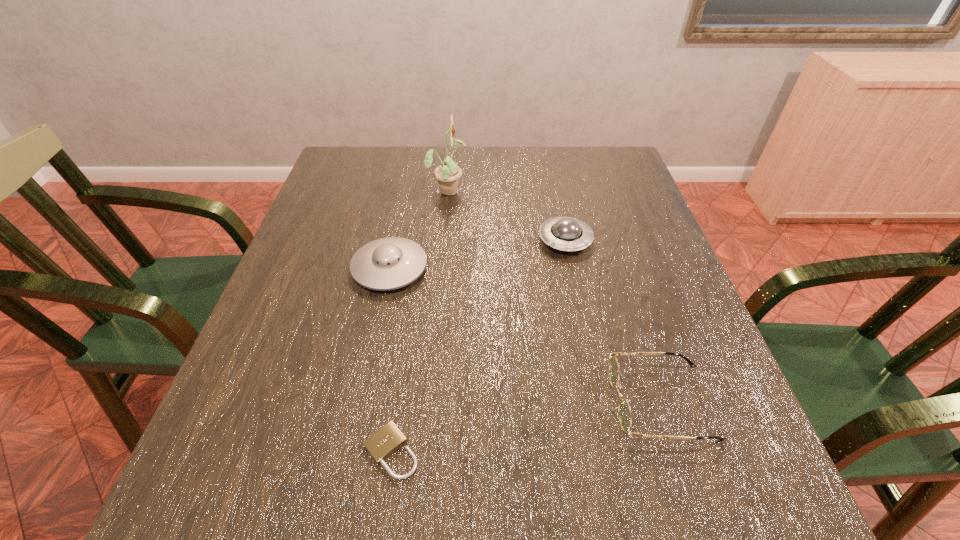
Image resolution: width=960 pixels, height=540 pixels. I want to click on vacant region located 0.310m on the lenses of the spectacles, so click(434, 401).

At what (x,y) coordinates should I click in order to perform the action: click on vacant area situated 0.150m on the lenses of the spectacles. Please return your answer as a coordinate pair (x, y). Looking at the image, I should click on (526, 401).

In order to click on vacant space situated on the back of the padlock in this screenshot , I will do `click(416, 279)`.

This screenshot has width=960, height=540. Find the location of `object that is at the far edge`. object that is at the far edge is located at coordinates (448, 173).

The image size is (960, 540). Find the location of `object located in the near edge section of the desktop`. object located in the near edge section of the desktop is located at coordinates (383, 443).

At what (x,y) coordinates should I click in order to perform the action: click on object that is at the left edge. Please return your answer as a coordinate pair (x, y). Looking at the image, I should click on (389, 263).

At what (x,y) coordinates should I click in order to perform the action: click on object located in the right edge section of the desktop. Please return your answer as a coordinate pair (x, y). Looking at the image, I should click on (624, 412).

In the image, there is a desktop. What are the coordinates of `free space at the far edge` in the screenshot? It's located at (414, 146).

Image resolution: width=960 pixels, height=540 pixels. I want to click on vacant space at the near edge of the desktop, so click(530, 480).

The image size is (960, 540). I want to click on vacant space at the left edge, so click(250, 342).